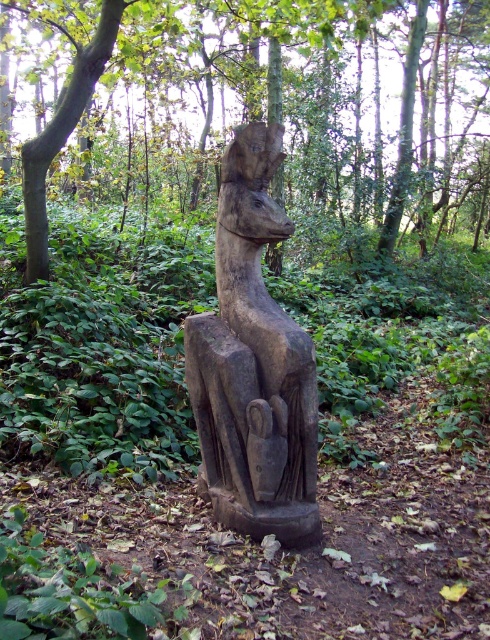
You are standing in a forest and see the point marked at coordinates [275,106]. What is located at that point?

The point at coordinates [275,106] marks the location of the smooth brown statue at center.

You are an art student visiting a forest and see the smooth brown statue at center and the dark brown wood statue at center. Which statue is larger?

The dark brown wood statue at center is larger than the smooth brown statue at center.